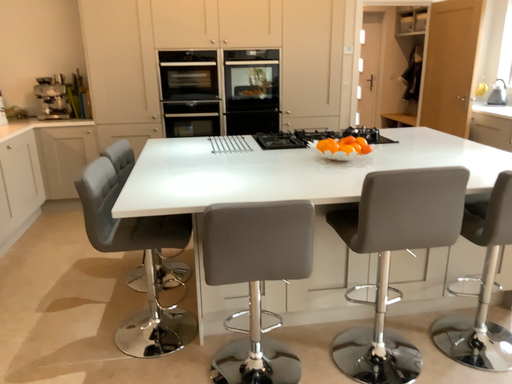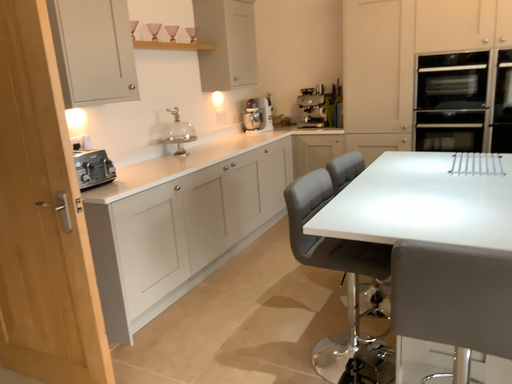
Question: How did the camera likely rotate when shooting the video?

Choices:
 (A) rotated right
 (B) rotated left

Answer: (B)